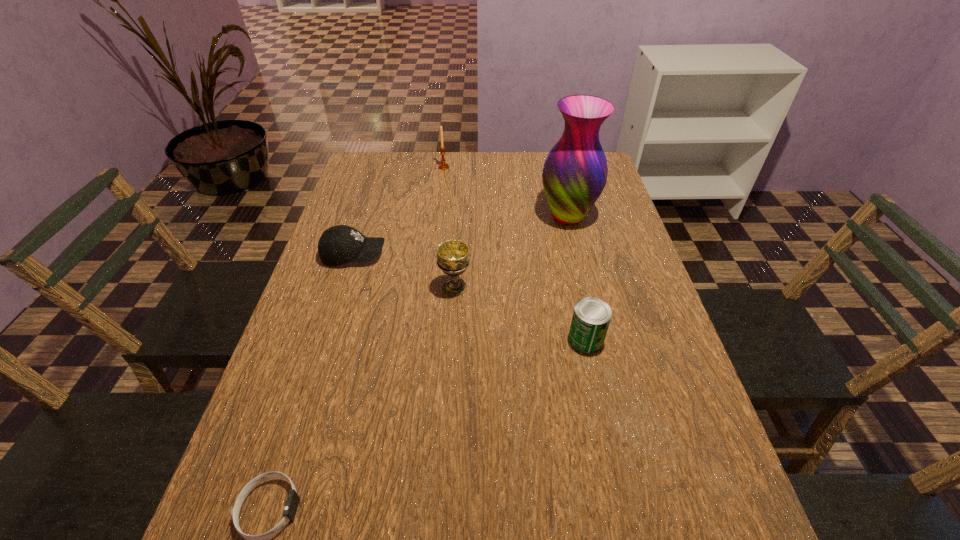
I want to click on vacant area that lies between the can and the fifth nearest object, so click(x=577, y=278).

Find the location of a particular element. This screenshot has width=960, height=540. free space between the baseball cap and the fourth object from right to left is located at coordinates (398, 211).

The image size is (960, 540). I want to click on vacant region between the baseball cap and the farthest object, so click(398, 211).

Find the location of a particular element. The width and height of the screenshot is (960, 540). empty space between the vase and the fifth shortest object is located at coordinates (506, 192).

Where is `vacant point located between the baseball cap and the chalice`? The image size is (960, 540). vacant point located between the baseball cap and the chalice is located at coordinates (404, 271).

I want to click on empty space that is in between the second nearest object and the fourth object from right to left, so click(x=515, y=253).

You are a GUI agent. You are given a task and a screenshot of the screen. Output one action in this format:
    pyautogui.click(x=<x>, y=<y>)
    Task: Click on the blank region between the farthest object and the can
    The width and height of the screenshot is (960, 540).
    Given the screenshot: What is the action you would take?
    pyautogui.click(x=515, y=253)

You are a GUI agent. You are given a task and a screenshot of the screen. Output one action in this format:
    pyautogui.click(x=<x>, y=<y>)
    Task: Click on the fifth closest object relative to the candle_holder
    This screenshot has width=960, height=540.
    Given the screenshot: What is the action you would take?
    tap(293, 498)

Identify the location of object that is the second closest to the tallest object. (443, 166).

In order to click on free space in the image that satisfies the following two spatial constraints: 1. on the front-facing side of the baseball cap; 2. on the right side of the chalice in this screenshot , I will do `click(344, 287)`.